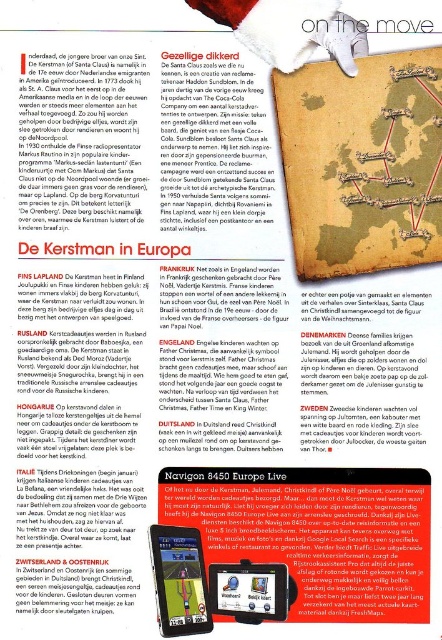
Consider the image. You are standing 5 feet away from the image. Is the point at position (178, 148) closer to you than the Santa hat illustration in the top right corner?

The point at position (178, 148) is 3.49 feet away from the viewer. Since you are standing 5 feet away from the image, the point is closer to you than the Santa hat illustration in the top right corner.

What is the object located at the coordinates point [362,163]?

The object located at point [362,163] is the green paper map at upper center.